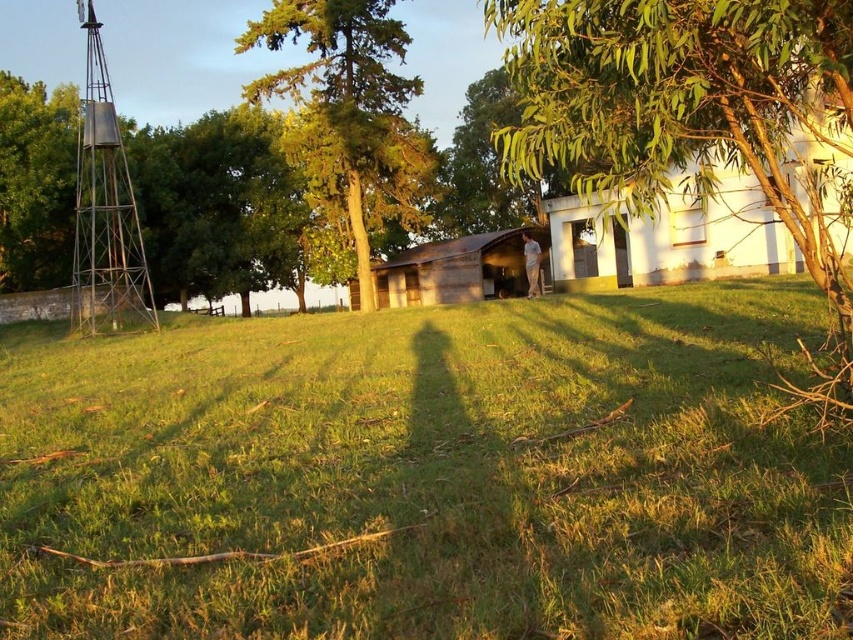
From the picture: You are standing at point point (x=274, y=13) and want to take a photo of the entire scene. The camera you have can capture a maximum distance of 25 meters. Will you be able to take the photo from your current position?

The distance between point (x=274, y=13) and the camera is 25.75 meters, which exceeds the camera maximum distance of 25 meters. Therefore, you won not be able to take the photo from your current position.

You are standing at the point with coordinates point (364, 154) and want to walk towards the point with coordinates point (469, 211). Which direction should you face to move directly towards it?

To move directly from point (364, 154) to point (469, 211), you should face northeast since the target point is northeast of your current position.

You are standing in the rural scene and want to place a small flag at both point (x=643, y=573) and point (x=129, y=328). Which point is closer to you where you are standing?

Point (x=643, y=573) is closer to the viewer than point (x=129, y=328), so the flag placed at point (x=643, y=573) will be closer to you.